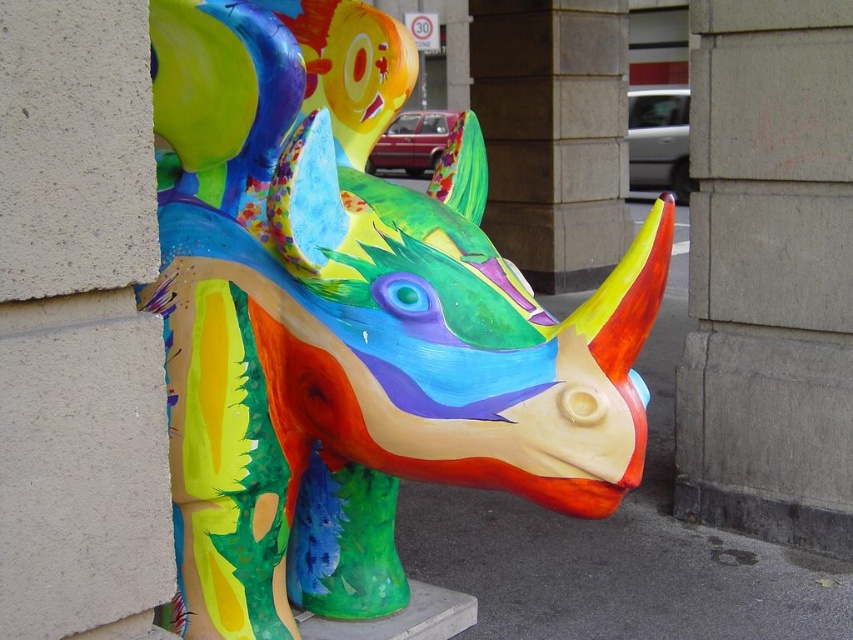
Question: Is multicolored painted rhinoceros at center wider than gray concrete pillar at center?

Choices:
 (A) yes
 (B) no

Answer: (A)

Question: Does multicolored painted rhinoceros at center have a smaller size compared to gray concrete pillar at center?

Choices:
 (A) no
 (B) yes

Answer: (A)

Question: Among these objects, which one is nearest to the camera?

Choices:
 (A) gray concrete pillar at center
 (B) multicolored painted rhinoceros at center

Answer: (B)

Question: Which object is closer to the camera taking this photo?

Choices:
 (A) multicolored painted rhinoceros at center
 (B) gray concrete pillar at center

Answer: (A)

Question: Can you confirm if multicolored painted rhinoceros at center is thinner than gray concrete pillar at center?

Choices:
 (A) yes
 (B) no

Answer: (B)